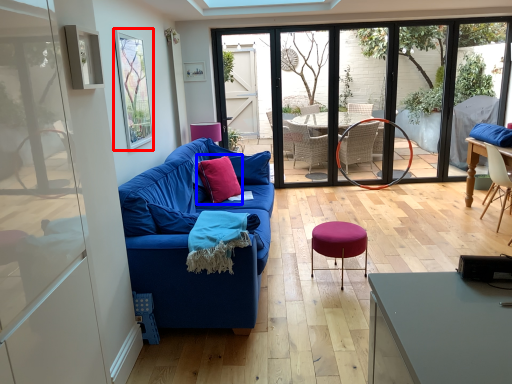
Question: Which point is closer to the camera, window screen (highlighted by a red box) or pillow (highlighted by a blue box)?

Choices:
 (A) window screen
 (B) pillow

Answer: (A)